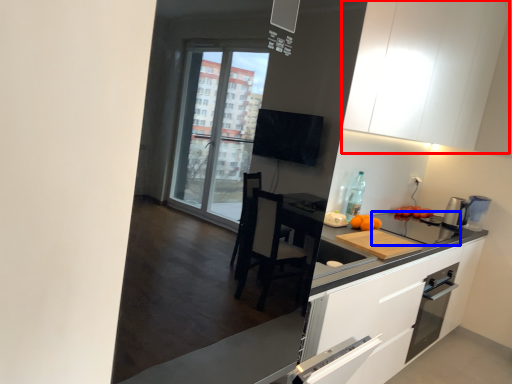
Question: Which point is further to the camera, cabinetry (highlighted by a red box) or appliance (highlighted by a blue box)?

Choices:
 (A) cabinetry
 (B) appliance

Answer: (B)